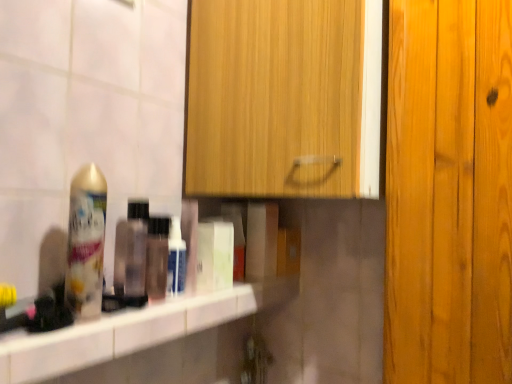
Question: Is white glossy bottle at center, the 1th mouthwash from the right, wider than wooden cabinet at upper center?

Choices:
 (A) no
 (B) yes

Answer: (A)

Question: Is wooden cabinet at upper center surrounded by white glossy bottle at center, the 1th mouthwash from the right?

Choices:
 (A) no
 (B) yes

Answer: (A)

Question: From a real-world perspective, is white glossy bottle at center, the 1th mouthwash from the right, positioned under wooden cabinet at upper center based on gravity?

Choices:
 (A) no
 (B) yes

Answer: (B)

Question: Does white glossy bottle at center, the 1th mouthwash from the right, come behind wooden cabinet at upper center?

Choices:
 (A) no
 (B) yes

Answer: (B)

Question: Does white glossy bottle at center, arranged as the 2th mouthwash when viewed from the left, have a larger size compared to wooden cabinet at upper center?

Choices:
 (A) yes
 (B) no

Answer: (B)

Question: From the image's perspective, is translucent plastic bottle at shelf, the first mouthwash in the left-to-right sequence, positioned above or below white glossy bottle at center, the 1th mouthwash from the right?

Choices:
 (A) below
 (B) above

Answer: (B)

Question: Based on their positions, is translucent plastic bottle at shelf, marked as the 2th mouthwash in a right-to-left arrangement, located to the left or right of white glossy bottle at center, the 1th mouthwash from the right?

Choices:
 (A) left
 (B) right

Answer: (A)

Question: Is translucent plastic bottle at shelf, the first mouthwash in the left-to-right sequence, taller or shorter than white glossy bottle at center, arranged as the 2th mouthwash when viewed from the left?

Choices:
 (A) short
 (B) tall

Answer: (B)

Question: Is translucent plastic bottle at shelf, the first mouthwash in the left-to-right sequence, in front of or behind white glossy bottle at center, arranged as the 2th mouthwash when viewed from the left, in the image?

Choices:
 (A) front
 (B) behind

Answer: (A)

Question: Relative to translucent plastic bottle at center, is translucent plastic bottle at shelf, marked as the 2th mouthwash in a right-to-left arrangement, in front or behind?

Choices:
 (A) front
 (B) behind

Answer: (B)

Question: Looking at the image, does translucent plastic bottle at shelf, marked as the 2th mouthwash in a right-to-left arrangement, seem bigger or smaller compared to translucent plastic bottle at center?

Choices:
 (A) big
 (B) small

Answer: (A)

Question: Considering the positions of translucent plastic bottle at shelf, marked as the 2th mouthwash in a right-to-left arrangement, and translucent plastic bottle at center in the image, is translucent plastic bottle at shelf, marked as the 2th mouthwash in a right-to-left arrangement, wider or thinner than translucent plastic bottle at center?

Choices:
 (A) wide
 (B) thin

Answer: (A)

Question: Is translucent plastic bottle at shelf, marked as the 2th mouthwash in a right-to-left arrangement, taller or shorter than translucent plastic bottle at center?

Choices:
 (A) short
 (B) tall

Answer: (B)

Question: Considering the positions of point (100, 200) and point (271, 150), is point (100, 200) closer or farther from the camera than point (271, 150)?

Choices:
 (A) closer
 (B) farther

Answer: (A)

Question: From a real-world perspective, is gold metallic can at left positioned above or below wooden cabinet at upper center?

Choices:
 (A) below
 (B) above

Answer: (A)